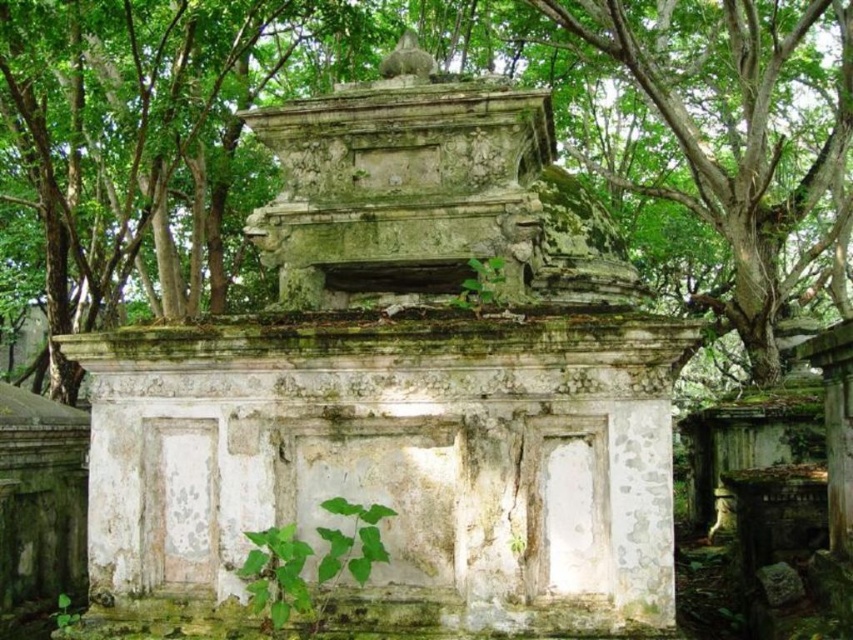
Question: Does green leafy tree at upper right have a smaller size compared to green leafy plant at lower center?

Choices:
 (A) yes
 (B) no

Answer: (A)

Question: From the image, what is the correct spatial relationship of green leafy tree at upper right in relation to green leafy plant at lower center?

Choices:
 (A) below
 (B) above

Answer: (B)

Question: Which object is closer to the camera taking this photo?

Choices:
 (A) green leafy tree at upper right
 (B) green leafy plant at lower center

Answer: (B)

Question: Which of the following is the closest to the observer?

Choices:
 (A) (302, 577)
 (B) (751, 120)

Answer: (A)

Question: Is green leafy tree at upper right closer to the viewer compared to green leafy plant at lower center?

Choices:
 (A) no
 (B) yes

Answer: (A)